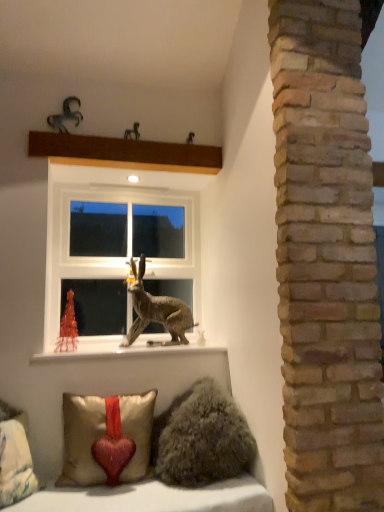
Locate an element on the screen. empty space that is ontop of brown wooden beam at upper center (from a real-world perspective) is located at coordinates (123, 138).